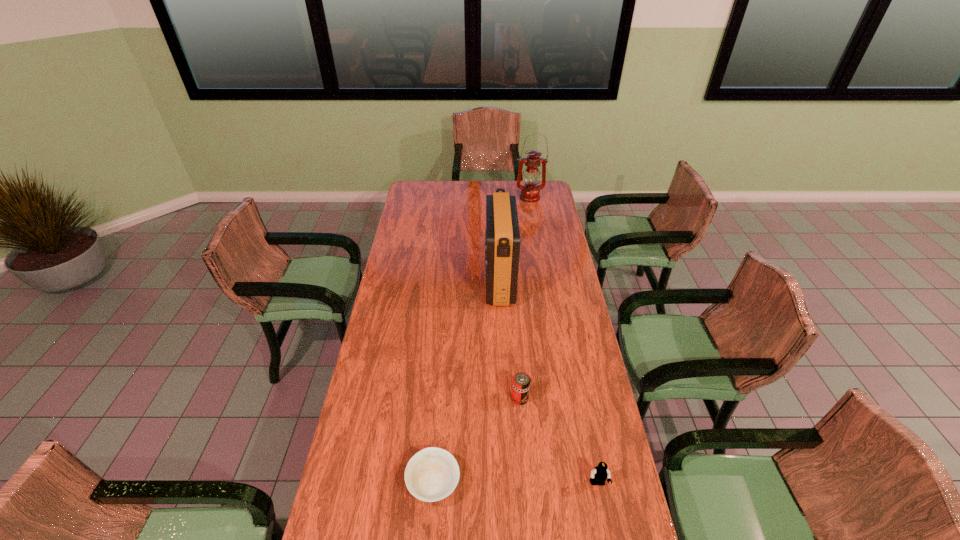
The height and width of the screenshot is (540, 960). Identify the location of the farthest object. (530, 192).

Identify the location of radio receiver. This screenshot has height=540, width=960. (502, 235).

The width and height of the screenshot is (960, 540). What are the coordinates of `the third farthest object` in the screenshot? It's located at (521, 381).

Identify the location of Lego. The height and width of the screenshot is (540, 960). (600, 473).

I want to click on the leftmost object, so click(x=432, y=474).

The width and height of the screenshot is (960, 540). I want to click on the shortest object, so click(432, 474).

Find the location of a particular element. Image resolution: width=960 pixels, height=540 pixels. vacant space located on the left of the farthest object is located at coordinates (475, 197).

The height and width of the screenshot is (540, 960). I want to click on free space located on the front-facing side of the fourth nearest object, so click(x=396, y=282).

Identify the location of free space located on the front-facing side of the fourth nearest object. (419, 282).

Identify the location of vacant space positioned 0.300m on the front-facing side of the fourth nearest object. (419, 282).